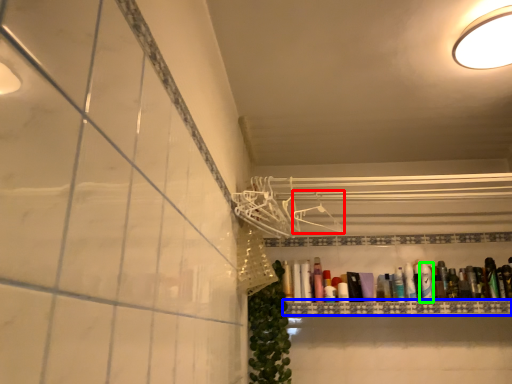
Question: Which is nearer to the hanger (highlighted by a red box)? ledge (highlighted by a blue box) or toiletry (highlighted by a green box).

Choices:
 (A) ledge
 (B) toiletry

Answer: (A)